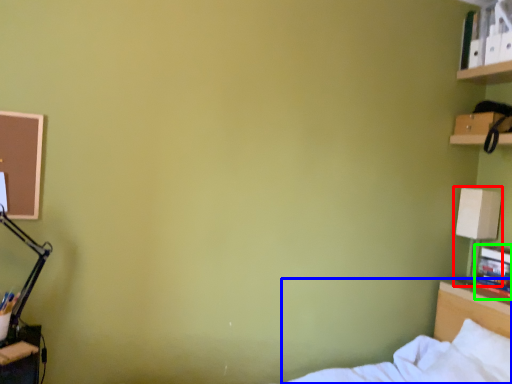
Question: Based on their relative distances, which object is farther from table lamp (highlighted by a red box)? Choose from bed (highlighted by a blue box) and book (highlighted by a green box).

Choices:
 (A) bed
 (B) book

Answer: (A)